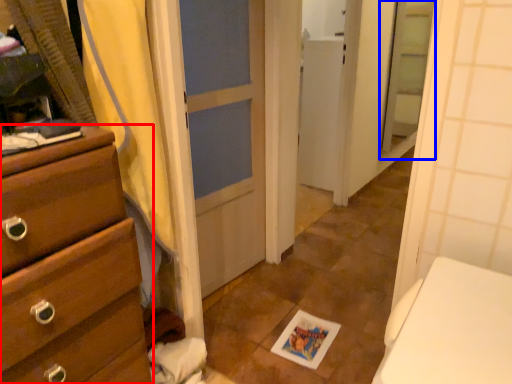
Question: Which point is closer to the camera, chest of drawers (highlighted by a red box) or screen door (highlighted by a blue box)?

Choices:
 (A) chest of drawers
 (B) screen door

Answer: (A)